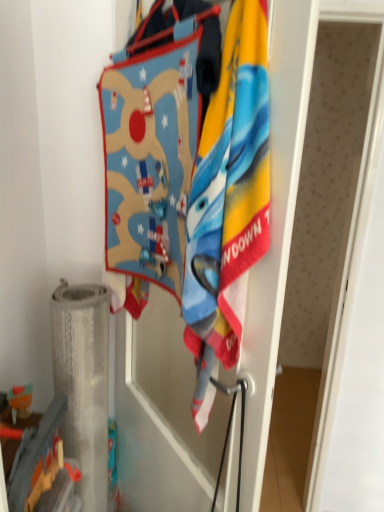
Question: Is metallic silver toy at lower left spatially inside soft cotton towel at center, or outside of it?

Choices:
 (A) outside
 (B) inside

Answer: (A)

Question: Considering the relative positions of metallic silver toy at lower left and soft cotton towel at center in the image provided, is metallic silver toy at lower left to the left or to the right of soft cotton towel at center?

Choices:
 (A) right
 (B) left

Answer: (B)

Question: In the image, is metallic silver toy at lower left positioned in front of or behind soft cotton towel at center?

Choices:
 (A) front
 (B) behind

Answer: (B)

Question: From a real-world perspective, is soft cotton towel at center physically located above or below metallic silver toy at lower left?

Choices:
 (A) above
 (B) below

Answer: (A)

Question: Is soft cotton towel at center bigger or smaller than metallic silver toy at lower left?

Choices:
 (A) small
 (B) big

Answer: (B)

Question: In the image, is soft cotton towel at center on the left side or the right side of metallic silver toy at lower left?

Choices:
 (A) left
 (B) right

Answer: (B)

Question: Is soft cotton towel at center spatially inside metallic silver toy at lower left, or outside of it?

Choices:
 (A) outside
 (B) inside

Answer: (A)